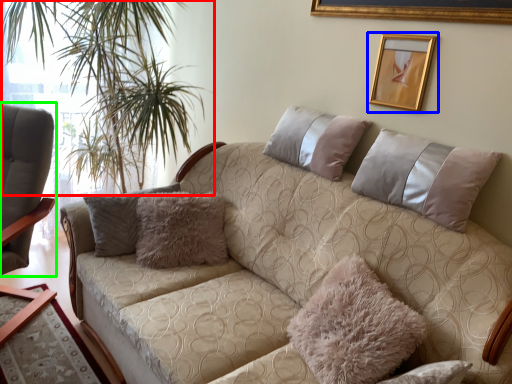
Question: Based on their relative distances, which object is farther from plant (highlighted by a red box)? Choose from picture frame (highlighted by a blue box) and chair (highlighted by a green box).

Choices:
 (A) picture frame
 (B) chair

Answer: (A)